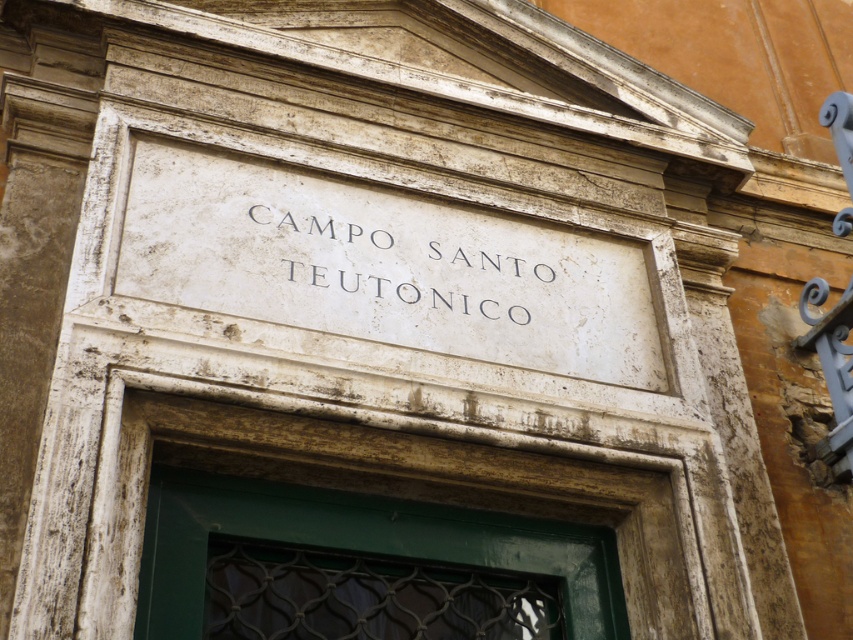
Based on the photo, you are an architect examining the building facade. You need to place a new decorative element at point (384,266). What is already present at that location?

At point (384,266) lies a white marble sign at center.

In the scene shown: You are standing in front of the building and see two points marked on the facade. The first point is at coordinates point (552, 285) and the second is at point (328, 276). Which point is closer to you?

Point (328, 276) is closer to you because it is in front of point (552, 285).

You are standing in front of a building with two signs. You see a white marble sign at center and a white stone sign at center. Which one is positioned to the right?

The white marble sign at center is to the right of the white stone sign at center.